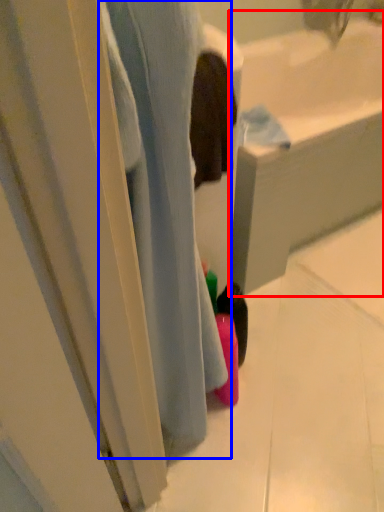
Question: Which object appears farthest to the camera in this image, bath (highlighted by a red box) or bath (highlighted by a blue box)?

Choices:
 (A) bath
 (B) bath

Answer: (A)